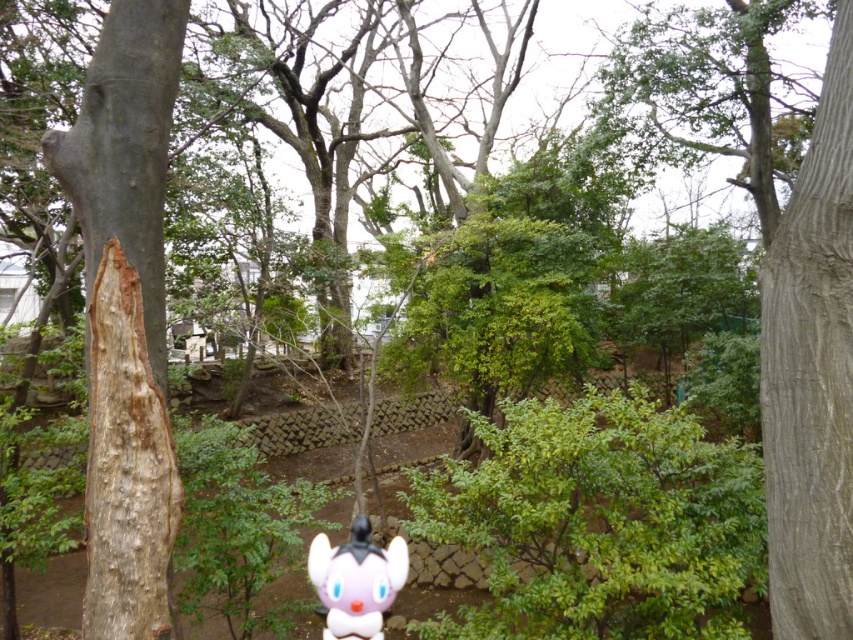
Question: Can you confirm if gray textured tree trunk at right is positioned below white glossy plush toy at center?

Choices:
 (A) yes
 (B) no

Answer: (B)

Question: Which of the following is the farthest from the observer?

Choices:
 (A) light brown rough bark at left
 (B) white glossy plush toy at center

Answer: (B)

Question: Is gray textured tree trunk at right smaller than light brown rough bark at left?

Choices:
 (A) no
 (B) yes

Answer: (A)

Question: Among these objects, which one is nearest to the camera?

Choices:
 (A) white glossy plush toy at center
 (B) light brown rough bark at left

Answer: (B)

Question: Does gray textured tree trunk at right have a lesser width compared to white glossy plush toy at center?

Choices:
 (A) yes
 (B) no

Answer: (A)

Question: Which is farther from the light brown rough bark at left?

Choices:
 (A) gray textured tree trunk at right
 (B) white glossy plush toy at center

Answer: (A)